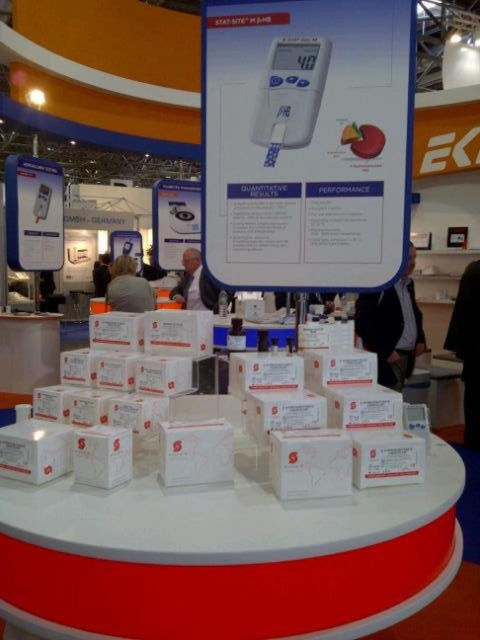
Question: Can you confirm if black fabric chair at right is smaller than gray fabric jacket at center?

Choices:
 (A) no
 (B) yes

Answer: (A)

Question: Which object appears closest to the camera in this image?

Choices:
 (A) gray fabric jacket at center
 (B) black fabric jacket at right

Answer: (B)

Question: Is black fabric jacket at right positioned at the back of gray fabric jacket at center?

Choices:
 (A) no
 (B) yes

Answer: (A)

Question: Can you confirm if black fabric jacket at right is positioned to the left of gray fabric jacket at center?

Choices:
 (A) yes
 (B) no

Answer: (B)

Question: Which of the following is the closest to the observer?

Choices:
 (A) (408, 355)
 (B) (132, 257)

Answer: (A)

Question: Which point is closer to the camera?

Choices:
 (A) (472, 268)
 (B) (386, 304)
 (C) (118, 269)

Answer: (B)